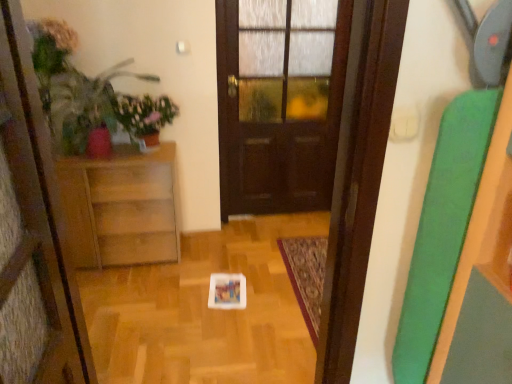
Question: Is matte green plant at left bigger than wooden cabinet at left?

Choices:
 (A) yes
 (B) no

Answer: (B)

Question: Is matte green plant at left to the right of wooden cabinet at left from the viewer's perspective?

Choices:
 (A) yes
 (B) no

Answer: (A)

Question: Can you confirm if matte green plant at left is thinner than wooden cabinet at left?

Choices:
 (A) no
 (B) yes

Answer: (A)

Question: Considering the relative sizes of matte green plant at left and wooden cabinet at left in the image provided, is matte green plant at left taller than wooden cabinet at left?

Choices:
 (A) no
 (B) yes

Answer: (A)

Question: From the image's perspective, does matte green plant at left appear higher than wooden cabinet at left?

Choices:
 (A) yes
 (B) no

Answer: (A)

Question: Considering the positions of point (136, 241) and point (106, 120), is point (136, 241) closer or farther from the camera than point (106, 120)?

Choices:
 (A) closer
 (B) farther

Answer: (B)

Question: Considering the relative positions of wooden cabinet at left and matte green plant at left in the image provided, is wooden cabinet at left to the left or to the right of matte green plant at left?

Choices:
 (A) left
 (B) right

Answer: (A)

Question: In terms of size, does wooden cabinet at left appear bigger or smaller than matte green plant at left?

Choices:
 (A) small
 (B) big

Answer: (B)

Question: From the image's perspective, is wooden cabinet at left above or below matte green plant at left?

Choices:
 (A) above
 (B) below

Answer: (B)

Question: From the image's perspective, is green matte plant at upper left positioned above or below matte green plant at left?

Choices:
 (A) above
 (B) below

Answer: (A)

Question: In terms of height, does green matte plant at upper left look taller or shorter compared to matte green plant at left?

Choices:
 (A) tall
 (B) short

Answer: (B)

Question: Considering the positions of point (124, 97) and point (64, 130), is point (124, 97) closer or farther from the camera than point (64, 130)?

Choices:
 (A) closer
 (B) farther

Answer: (B)

Question: Looking at the image, does green matte plant at upper left seem bigger or smaller compared to matte green plant at left?

Choices:
 (A) big
 (B) small

Answer: (B)

Question: In the image, is wooden cabinet at left positioned in front of or behind dark wood door at center?

Choices:
 (A) behind
 (B) front

Answer: (B)

Question: Which is correct: wooden cabinet at left is inside dark wood door at center, or outside of it?

Choices:
 (A) outside
 (B) inside

Answer: (A)